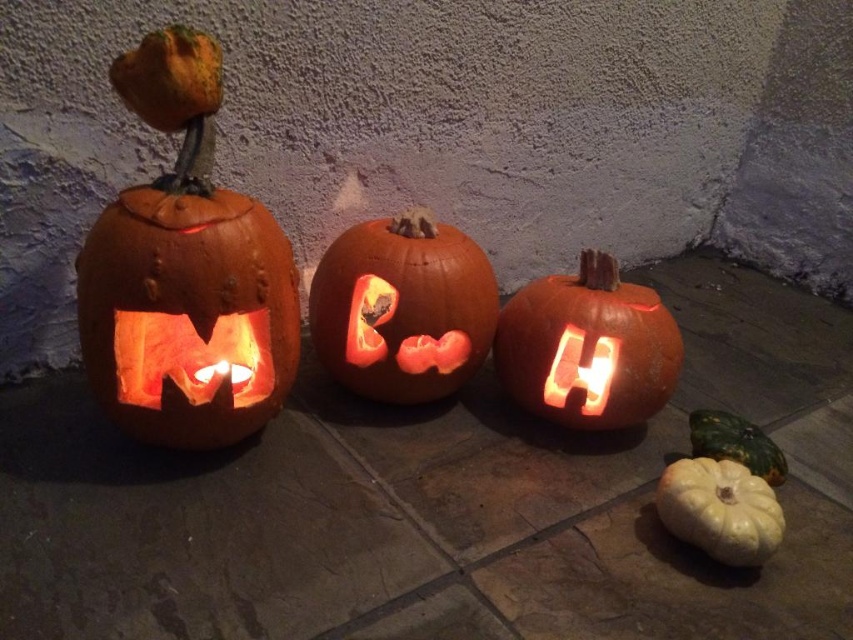
Question: Which point is closer to the camera taking this photo?

Choices:
 (A) (263, 284)
 (B) (685, 472)

Answer: (A)

Question: Can you confirm if orange carved pumpkin at center is smaller than smooth white pumpkin at lower right?

Choices:
 (A) no
 (B) yes

Answer: (A)

Question: Does orange carved pumpkin at center appear under smooth white pumpkin at lower right?

Choices:
 (A) no
 (B) yes

Answer: (A)

Question: Can you confirm if orange carved pumpkin at center is bigger than orange matte carved pumpkin at center?

Choices:
 (A) no
 (B) yes

Answer: (B)

Question: Which object is positioned farthest from the smooth white gourd at lower right?

Choices:
 (A) smooth white pumpkin at lower right
 (B) carved orange pumpkin at left

Answer: (B)

Question: Which object is closer to the camera taking this photo?

Choices:
 (A) orange matte carved pumpkin at center
 (B) smooth white gourd at lower right
 (C) orange carved pumpkin at center
 (D) carved orange pumpkin at left

Answer: (D)